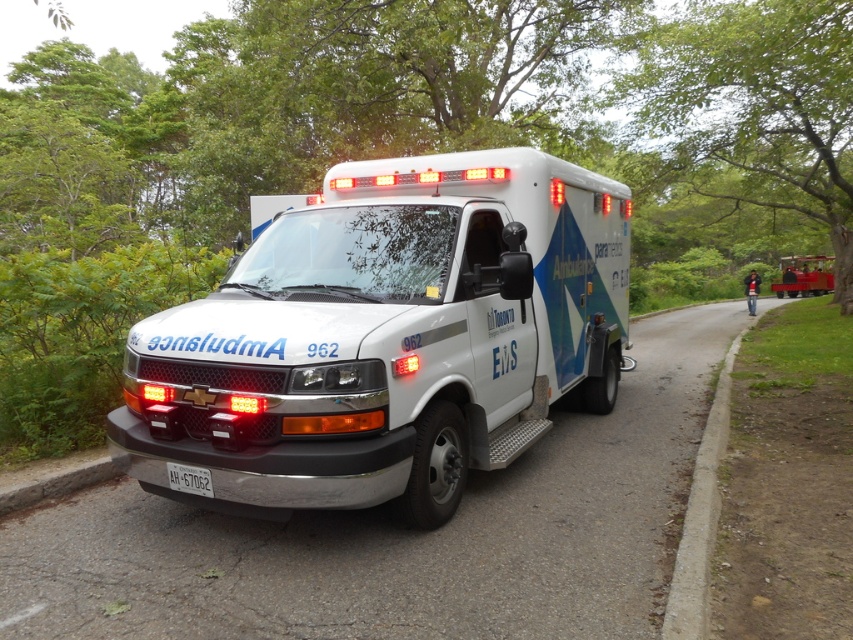
You are a photographer taking a picture of the white glossy ambulance at center and the white plastic license plate at lower center. Which object will appear larger in your photo?

The white glossy ambulance at center will appear larger in the photo because it is closer to the viewer than the white plastic license plate at lower center.